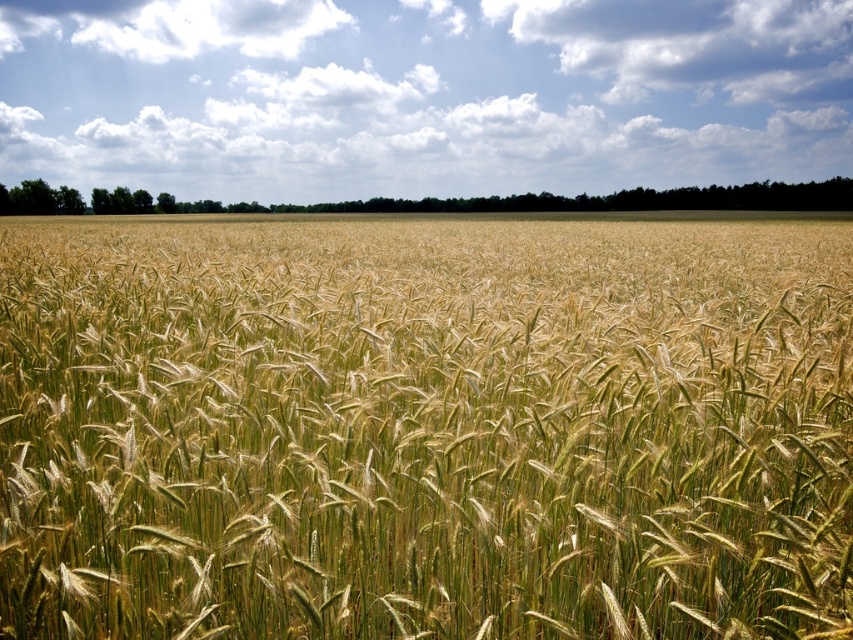
Question: Among these points, which one is farthest from the camera?

Choices:
 (A) (766, 51)
 (B) (741, 397)

Answer: (A)

Question: Is green grassy wheat at center thinner than white fluffy clouds at upper center?

Choices:
 (A) no
 (B) yes

Answer: (B)

Question: Is green grassy wheat at center closer to camera compared to white fluffy clouds at upper center?

Choices:
 (A) yes
 (B) no

Answer: (A)

Question: Which object appears closest to the camera in this image?

Choices:
 (A) white fluffy clouds at upper center
 (B) green grassy wheat at center

Answer: (B)

Question: Can you confirm if green grassy wheat at center is positioned above white fluffy clouds at upper center?

Choices:
 (A) no
 (B) yes

Answer: (A)